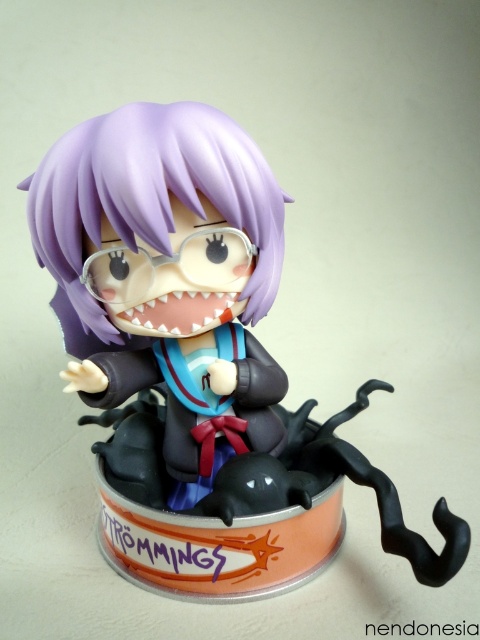
Which of these two, matte purple figure at center or purple matte hair at center, stands shorter?

purple matte hair at center is shorter.

From the picture: Is matte purple figure at center positioned in front of purple matte hair at center?

No, matte purple figure at center is further to the viewer.

Is point (192, 147) positioned in front of point (235, 138)?

Yes.

The height and width of the screenshot is (640, 480). Identify the location of matte purple figure at center. (196, 360).